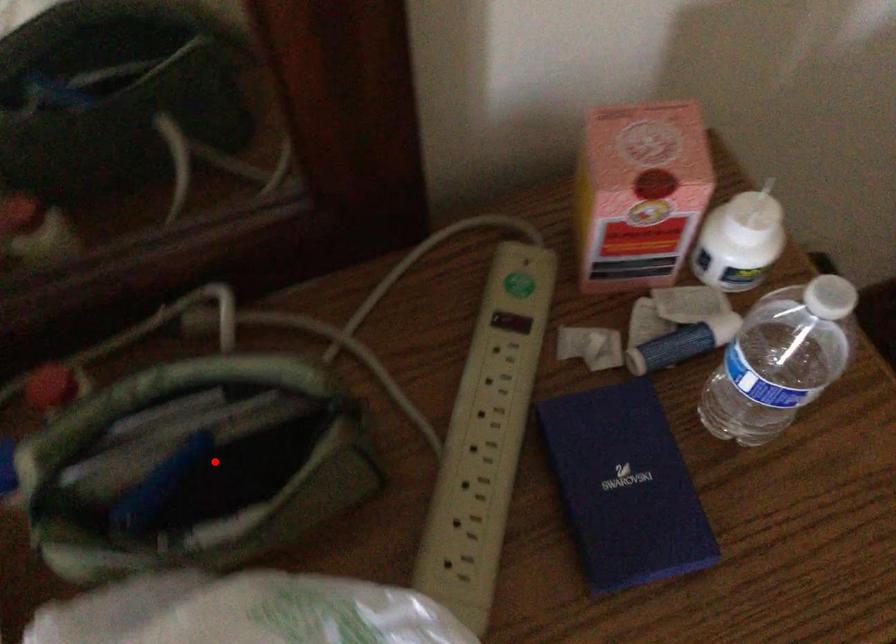
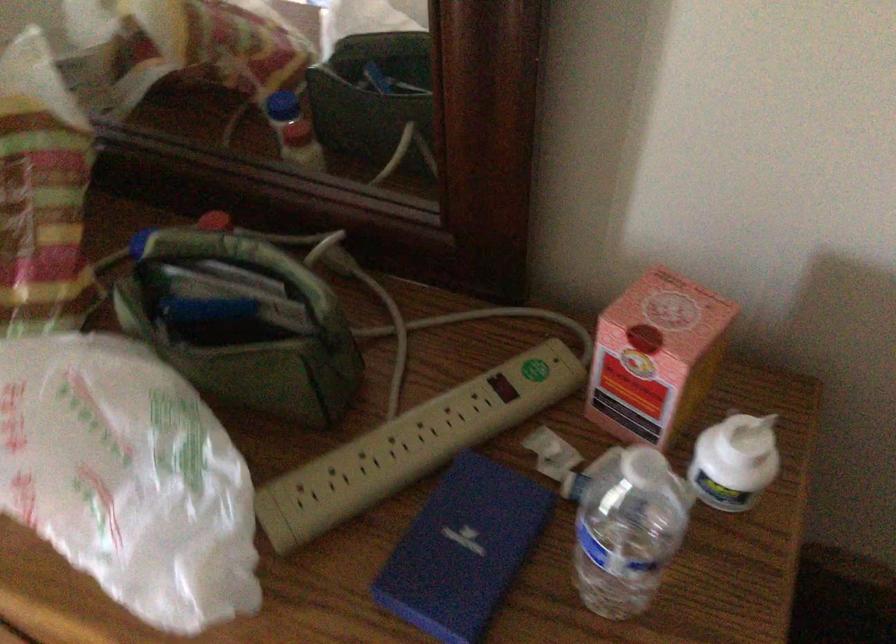
Locate, in the second image, the point that corresponds to the highlighted location in the first image.

(239, 322)